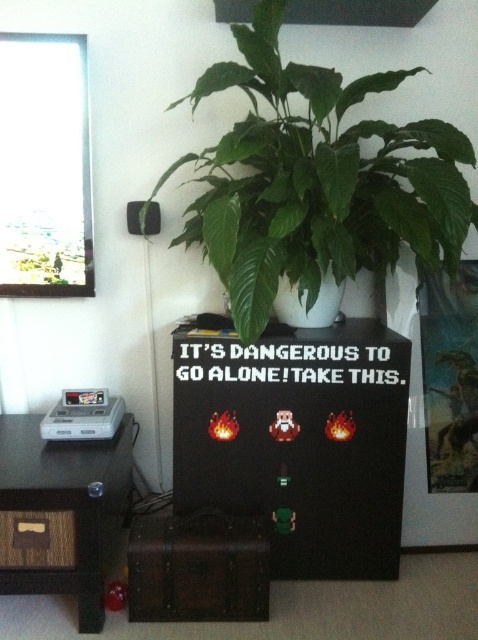
Which is behind, point (188, 205) or point (52, 412)?

The point (188, 205) is behind.

Describe the element at coordinates (316, 180) in the screenshot. I see `green leafy plant at upper center` at that location.

What do you see at coordinates (316, 180) in the screenshot? The width and height of the screenshot is (478, 640). I see `green leafy plant at upper center` at bounding box center [316, 180].

Locate an element on the screen. green leafy plant at upper center is located at coordinates (316, 180).

This screenshot has height=640, width=478. What are the coordinates of `metallic silver poster at right` in the screenshot? It's located at (449, 378).

Who is higher up, metallic silver poster at right or white plastic game console at left?

metallic silver poster at right is higher up.

Is point (432, 337) positioned in front of point (71, 436)?

No, it is behind (71, 436).

You are a GUI agent. You are given a task and a screenshot of the screen. Output one action in this format:
    pyautogui.click(x=<x>, y=<y>)
    Task: Click on the metallic silver poster at right
    Image resolution: width=478 pixels, height=640 pixels.
    Given the screenshot: What is the action you would take?
    pyautogui.click(x=449, y=378)

Which is more to the left, brushed wood table at left or white plastic game console at left?

brushed wood table at left is more to the left.

Which is below, brushed wood table at left or white plastic game console at left?

brushed wood table at left is below.

Does point (57, 490) lie behind point (95, 394)?

No, it is not.

Where is `brushed wood table at left`? brushed wood table at left is located at coordinates (63, 513).